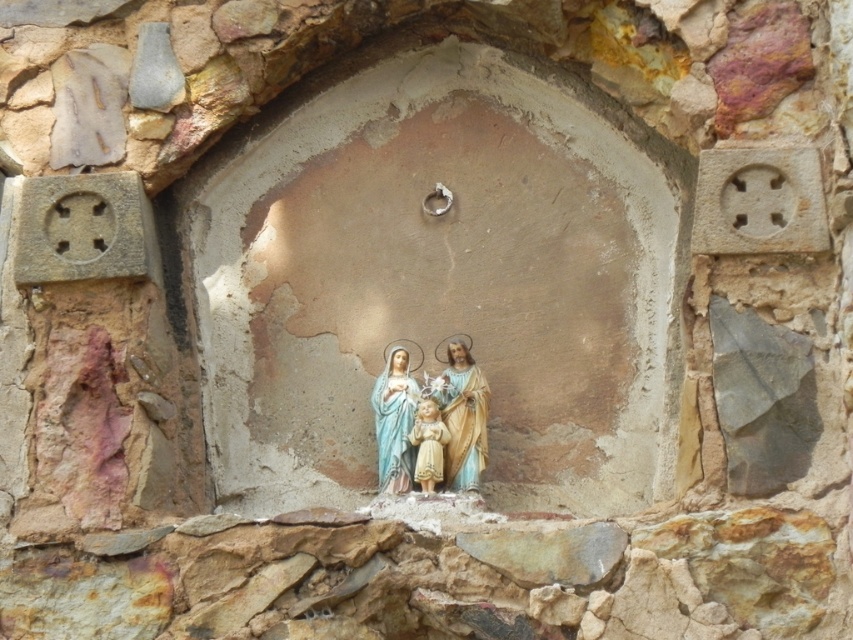
In the scene shown: You are an interior designer planning to place a decorative item that is 28 inches wide between the matte plastic statue at center and the smooth beige figurine at center in the niche. Based on the space between them, will the item fit comfortably without overlapping either statue?

The matte plastic statue at center and the smooth beige figurine at center are 27.99 inches apart from each other. Since the decorative item is 28 inches wide, it would not fit comfortably as it would overlap both statues slightly.